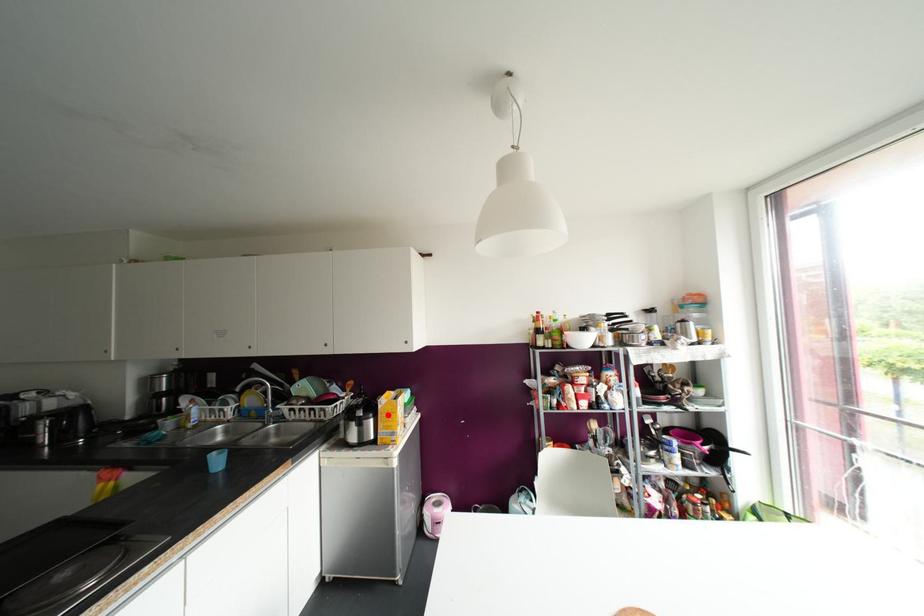
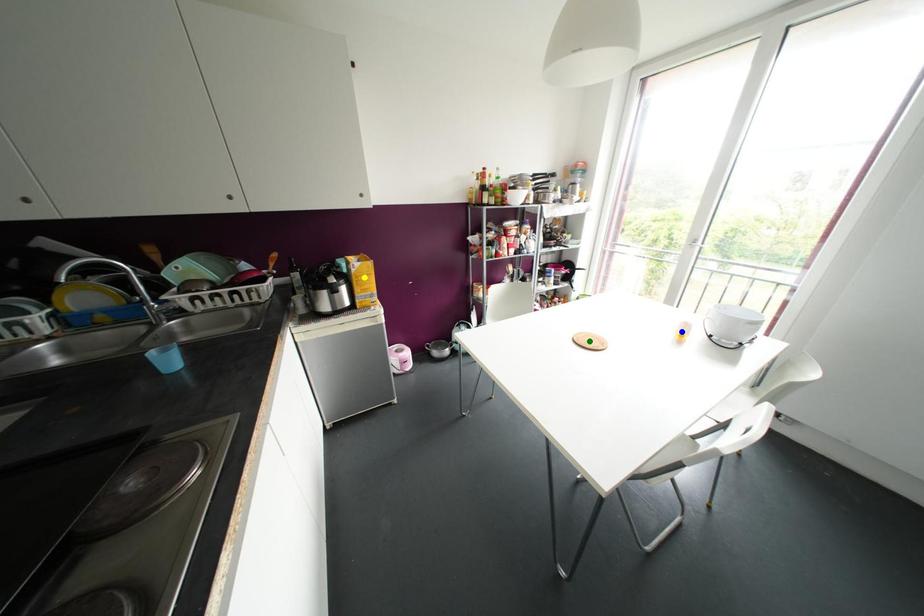
Question: I am providing you with two images of the same scene from different viewpoints. A red point is marked on the first image. You are given multiple points on the second image. In image 2, which mark is for the same physical point as the one in image 1?

Choices:
 (A) green point
 (B) blue point
 (C) yellow point

Answer: (C)